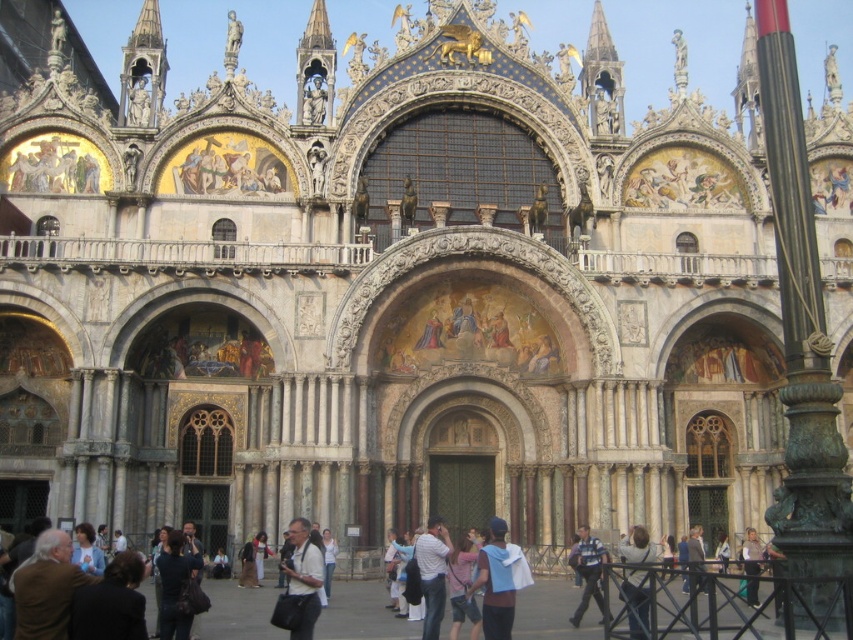
Who is positioned more to the right, light gray fabric shirt at center or blue denim jeans at lower center?

blue denim jeans at lower center

Can you confirm if light gray fabric shirt at center is shorter than blue denim jeans at lower center?

No.

Is point (306, 532) farther from camera compared to point (576, 548)?

No, (306, 532) is in front of (576, 548).

The image size is (853, 640). Find the location of `light gray fabric shirt at center`. light gray fabric shirt at center is located at coordinates (305, 577).

Between point (631, 588) and point (757, 593), which one is positioned in front?

Point (631, 588) is in front.

Is point (627, 604) positioned after point (753, 531)?

No.

Does point (636, 612) come farther from viewer compared to point (757, 604)?

No, it is not.

Locate an element on the screen. light blue denim jacket at lower right is located at coordinates (637, 604).

Does light blue fabric jacket at center have a greater height compared to blue denim jeans at lower center?

Yes.

Between light blue fabric jacket at center and blue denim jeans at lower center, which one appears on the right side from the viewer's perspective?

blue denim jeans at lower center is more to the right.

Between point (503, 598) and point (590, 573), which one is positioned in front?

Positioned in front is point (503, 598).

Image resolution: width=853 pixels, height=640 pixels. In order to click on light blue fabric jacket at center in this screenshot , I will do `click(496, 580)`.